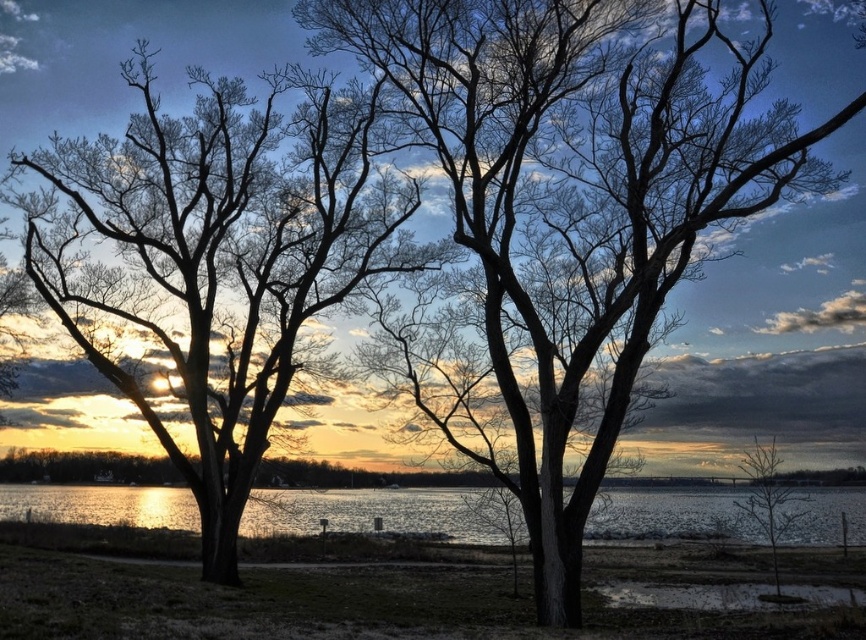
Can you confirm if glistening water at center is bigger than bare branches at lower right?

Yes.

Is glistening water at center taller than bare branches at lower right?

Indeed, glistening water at center has a greater height compared to bare branches at lower right.

The image size is (866, 640). What do you see at coordinates (372, 513) in the screenshot?
I see `glistening water at center` at bounding box center [372, 513].

Locate an element on the screen. The width and height of the screenshot is (866, 640). glistening water at center is located at coordinates (372, 513).

From the picture: Is silhouette bark tree at center taller than smooth bark tree at center?

No, silhouette bark tree at center is not taller than smooth bark tree at center.

Locate an element on the screen. Image resolution: width=866 pixels, height=640 pixels. silhouette bark tree at center is located at coordinates (576, 196).

Is point (352, 108) in front of point (773, 538)?

Yes, it is.

Who is taller, smooth bark tree at center or bare branches at lower right?

Standing taller between the two is smooth bark tree at center.

At what (x,y) coordinates should I click in order to perform the action: click on smooth bark tree at center. Please return your answer as a coordinate pair (x, y). The image size is (866, 640). Looking at the image, I should click on (217, 253).